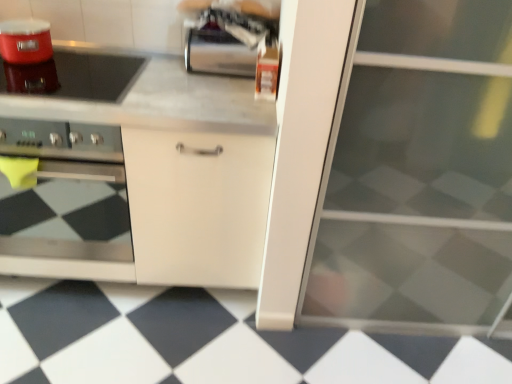
The width and height of the screenshot is (512, 384). What do you see at coordinates (25, 41) in the screenshot?
I see `matte red rice cooker at upper left` at bounding box center [25, 41].

Where is `matte red rice cooker at upper left`? matte red rice cooker at upper left is located at coordinates (25, 41).

Where is `shiny black glass at upper left`? shiny black glass at upper left is located at coordinates (74, 76).

The height and width of the screenshot is (384, 512). I want to click on matte red rice cooker at upper left, so click(x=25, y=41).

From the image's perspective, is transparent glass screen door at right over stainless steel oven at left?

No, from the image's perspective, transparent glass screen door at right is not above stainless steel oven at left.

Is transparent glass screen door at right in front of or behind stainless steel oven at left in the image?

transparent glass screen door at right is in front of stainless steel oven at left.

What's the angular difference between transparent glass screen door at right and stainless steel oven at left's facing directions?

The angular difference between transparent glass screen door at right and stainless steel oven at left is 0.367 degrees.

In the scene shown: Considering the sizes of objects transparent glass screen door at right and stainless steel oven at left in the image provided, who is taller, transparent glass screen door at right or stainless steel oven at left?

transparent glass screen door at right is taller.

Considering the relative sizes of white matte cabinet at center and transparent glass screen door at right in the image provided, is white matte cabinet at center shorter than transparent glass screen door at right?

Yes, white matte cabinet at center is shorter than transparent glass screen door at right.

Considering the sizes of objects white matte cabinet at center and transparent glass screen door at right in the image provided, who is thinner, white matte cabinet at center or transparent glass screen door at right?

white matte cabinet at center.

How far apart are white matte cabinet at center and transparent glass screen door at right?

white matte cabinet at center is 27.32 inches away from transparent glass screen door at right.

In order to click on screen door above the white matte cabinet at center (from the image's perspective) in this screenshot , I will do `click(418, 174)`.

Which point is more distant from viewer, (37, 21) or (91, 249)?

The point (37, 21) is more distant.

Is matte red rice cooker at upper left positioned beyond the bounds of white matte cabinet at center?

Yes, matte red rice cooker at upper left is outside of white matte cabinet at center.

From the image's perspective, which object appears higher, matte red rice cooker at upper left or white matte cabinet at center?

From the image's view, matte red rice cooker at upper left is above.

From a real-world perspective, who is located higher, shiny black glass at upper left or transparent glass screen door at right?

shiny black glass at upper left, from a real-world perspective.

Can you confirm if shiny black glass at upper left is bigger than transparent glass screen door at right?

Incorrect, shiny black glass at upper left is not larger than transparent glass screen door at right.

You are a GUI agent. You are given a task and a screenshot of the screen. Output one action in this format:
    pyautogui.click(x=<x>, y=<y>)
    Task: Click on the screen door lying in front of the shiny black glass at upper left
    The height and width of the screenshot is (384, 512).
    Given the screenshot: What is the action you would take?
    pyautogui.click(x=418, y=174)

Is point (23, 86) in front of point (497, 203)?

No, (23, 86) is behind (497, 203).

Is transparent glass screen door at right inside the boundaries of satin metallic paper towel holder at upper center, or outside?

transparent glass screen door at right is not enclosed by satin metallic paper towel holder at upper center.

Can you tell me how much transparent glass screen door at right and satin metallic paper towel holder at upper center differ in facing direction?

The facing directions of transparent glass screen door at right and satin metallic paper towel holder at upper center are 0.367 degrees apart.

In the scene shown: Considering the sizes of transparent glass screen door at right and satin metallic paper towel holder at upper center in the image, is transparent glass screen door at right wider or thinner than satin metallic paper towel holder at upper center?

transparent glass screen door at right is wider than satin metallic paper towel holder at upper center.

From the image's perspective, between white matte cabinet at center and satin metallic paper towel holder at upper center, who is located below?

white matte cabinet at center appears lower in the image.

Can you confirm if white matte cabinet at center is thinner than satin metallic paper towel holder at upper center?

In fact, white matte cabinet at center might be wider than satin metallic paper towel holder at upper center.

From a real-world perspective, which is physically above, white matte cabinet at center or satin metallic paper towel holder at upper center?

satin metallic paper towel holder at upper center is physically above.

Which is more to the right, white matte cabinet at center or satin metallic paper towel holder at upper center?

From the viewer's perspective, satin metallic paper towel holder at upper center appears more on the right side.

How many degrees apart are the facing directions of transparent glass screen door at right and white matte cabinet at center?

They differ by 0.0732 degrees in their facing directions.

Based on the photo, in terms of size, does transparent glass screen door at right appear bigger or smaller than white matte cabinet at center?

Clearly, transparent glass screen door at right is larger in size than white matte cabinet at center.

Based on the photo, which object is thinner, transparent glass screen door at right or white matte cabinet at center?

white matte cabinet at center.

From the image's perspective, relative to white matte cabinet at center, is transparent glass screen door at right above or below?

transparent glass screen door at right is situated higher than white matte cabinet at center in the image.

I want to click on screen door in front of the stainless steel oven at left, so click(418, 174).

The height and width of the screenshot is (384, 512). In the image, there is a transparent glass screen door at right. Identify the location of cabinetry below it (from a real-world perspective). (139, 174).

Based on their spatial positions, is satin metallic paper towel holder at upper center or stainless steel oven at left closer to transparent glass screen door at right?

Based on the image, satin metallic paper towel holder at upper center appears to be nearer to transparent glass screen door at right.

Which object lies further to the anchor point stainless steel oven at left, matte red rice cooker at upper left or white matte cabinet at center?

Among the two, matte red rice cooker at upper left is located further to stainless steel oven at left.

From the image, which object appears to be nearer to matte red rice cooker at upper left, shiny black glass at upper left or black glossy tile at lower center?

shiny black glass at upper left is positioned closer to the anchor matte red rice cooker at upper left.

When comparing their distances from shiny black glass at upper left, does white matte cabinet at center or stainless steel oven at left seem closer?

Among the two, white matte cabinet at center is located nearer to shiny black glass at upper left.

When comparing their distances from shiny black glass at upper left, does transparent glass screen door at right or satin metallic paper towel holder at upper center seem further?

transparent glass screen door at right is further to shiny black glass at upper left.

Which object lies further to the anchor point white matte cabinet at center, satin metallic paper towel holder at upper center or stainless steel oven at left?

satin metallic paper towel holder at upper center lies further to white matte cabinet at center than the other object.

Looking at the image, which one is located closer to stainless steel oven at left, satin metallic paper towel holder at upper center or shiny black glass at upper left?

Based on the image, shiny black glass at upper left appears to be nearer to stainless steel oven at left.

Considering their positions, is stainless steel oven at left positioned further to satin metallic paper towel holder at upper center than matte red rice cooker at upper left?

stainless steel oven at left is positioned further to the anchor satin metallic paper towel holder at upper center.

Locate an element on the screen. screen door between satin metallic paper towel holder at upper center and black glossy tile at lower center vertically is located at coordinates (418, 174).

I want to click on cabinetry situated between stainless steel oven at left and satin metallic paper towel holder at upper center from left to right, so click(x=139, y=174).

What are the coordinates of `appliance located between matte red rice cooker at upper left and transparent glass screen door at right in the left-right direction` in the screenshot? It's located at (226, 41).

Where is `gas stove between stainless steel oven at left and satin metallic paper towel holder at upper center`? The width and height of the screenshot is (512, 384). gas stove between stainless steel oven at left and satin metallic paper towel holder at upper center is located at coordinates (74, 76).